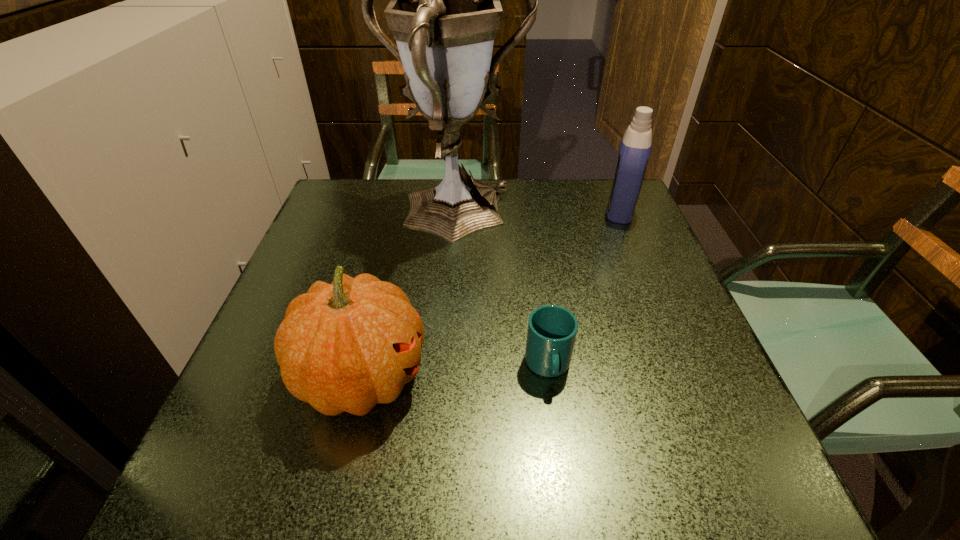
Image resolution: width=960 pixels, height=540 pixels. What are the coordinates of `trophy cup` in the screenshot? It's located at (446, 2).

Locate an element on the screen. detergent is located at coordinates (635, 148).

At what (x,y) coordinates should I click in order to perform the action: click on the second shortest object. Please return your answer as a coordinate pair (x, y). The width and height of the screenshot is (960, 540). Looking at the image, I should click on point(346,346).

Where is `cup`? This screenshot has width=960, height=540. cup is located at coordinates (552, 329).

Identify the location of vacant space situated 0.110m on the front of the tallest object. The image size is (960, 540). (448, 299).

You are a GUI agent. You are given a task and a screenshot of the screen. Output one action in this format:
    pyautogui.click(x=<x>, y=<y>)
    Task: Click on the blank space located on the front of the rightmost object
    
    Given the screenshot: What is the action you would take?
    pyautogui.click(x=682, y=355)

Where is `vacant space located on the carved face of the third tallest object`? vacant space located on the carved face of the third tallest object is located at coordinates (647, 377).

Image resolution: width=960 pixels, height=540 pixels. What are the coordinates of `vacant space situated 0.110m on the handle side of the cup` in the screenshot? It's located at (561, 456).

Identify the location of trophy cup that is at the far edge. (446, 2).

The width and height of the screenshot is (960, 540). I want to click on detergent that is at the far edge, so click(635, 148).